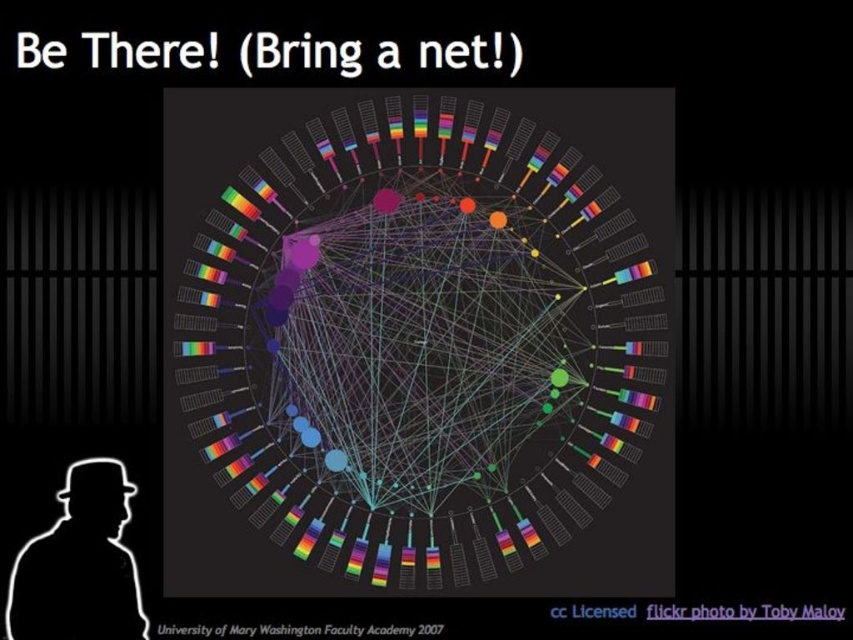
Question: Which of the following is the farthest from the observer?

Choices:
 (A) white matte silhouette at lower left
 (B) rainbow plastic network at center

Answer: (B)

Question: Is rainbow plastic network at center smaller than white matte silhouette at lower left?

Choices:
 (A) no
 (B) yes

Answer: (A)

Question: Can you confirm if rainbow plastic network at center is thinner than white matte silhouette at lower left?

Choices:
 (A) no
 (B) yes

Answer: (A)

Question: Which of the following is the closest to the observer?

Choices:
 (A) rainbow plastic network at center
 (B) white matte silhouette at lower left

Answer: (B)

Question: Does rainbow plastic network at center appear on the right side of white matte silhouette at lower left?

Choices:
 (A) yes
 (B) no

Answer: (A)

Question: Which point is farther to the camera?

Choices:
 (A) rainbow plastic network at center
 (B) white matte silhouette at lower left

Answer: (A)